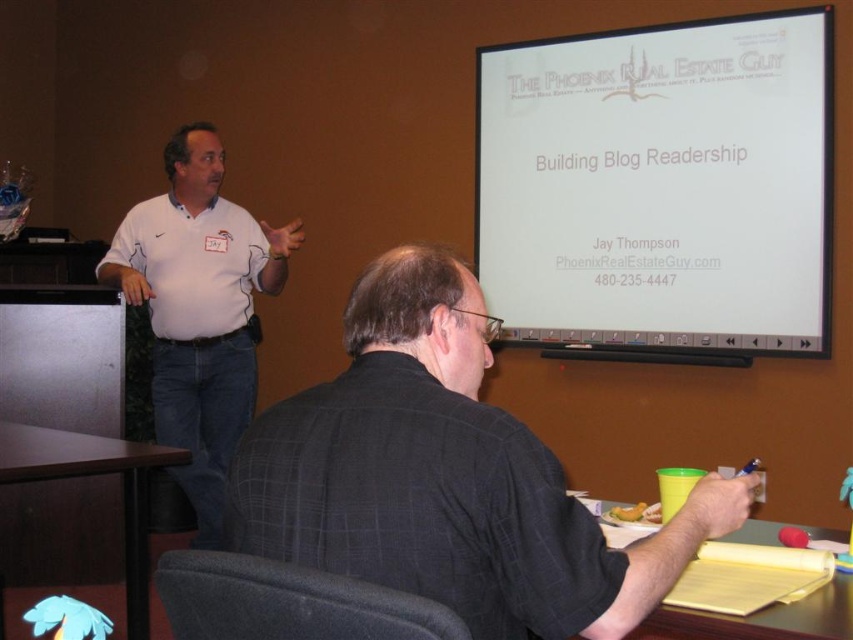
Is white matte projection screen at upper center shorter than white shirt at left?

Yes, white matte projection screen at upper center is shorter than white shirt at left.

Image resolution: width=853 pixels, height=640 pixels. What do you see at coordinates (660, 184) in the screenshot? I see `white matte projection screen at upper center` at bounding box center [660, 184].

Locate an element on the screen. Image resolution: width=853 pixels, height=640 pixels. white matte projection screen at upper center is located at coordinates (660, 184).

Between dark gray checkered shirt at center and white shirt at left, which one is positioned higher?

dark gray checkered shirt at center is higher up.

Is point (492, 476) in front of point (151, 262)?

Yes, point (492, 476) is in front of point (151, 262).

Identify the location of dark gray checkered shirt at center. The width and height of the screenshot is (853, 640). (445, 476).

Can you confirm if white shirt at left is taller than yellow paper at lower right?

Indeed, white shirt at left has a greater height compared to yellow paper at lower right.

This screenshot has height=640, width=853. In order to click on white shirt at left in this screenshot , I will do pyautogui.click(x=199, y=308).